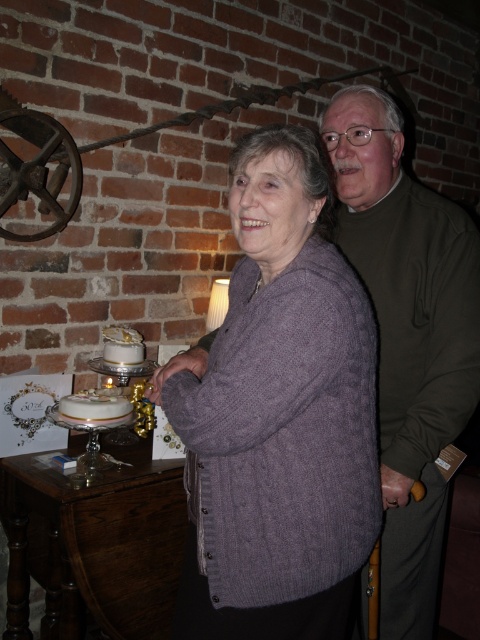
You are a photographer trying to capture the purple knitted sweater at center in a closeup shot. Given that the camera frame is centered at point 0.5, 0.5, what direction should you move the camera to focus on the sweater?

The purple knitted sweater at center is located at point (280, 413). Since the camera frame is centered at (240, 320), you need to move the camera to the right and slightly upward to focus on the sweater.

You are planning to take a photo of the purple knitted sweater at center and the brown wooden table at lower left. Based on their positions, which object should you focus on first if you want to capture both in the same frame without moving the camera?

The brown wooden table at lower left should be focused on first because the purple knitted sweater at center is to the right of it, so by starting with the table on the left, you can ensure both objects are included in the frame.